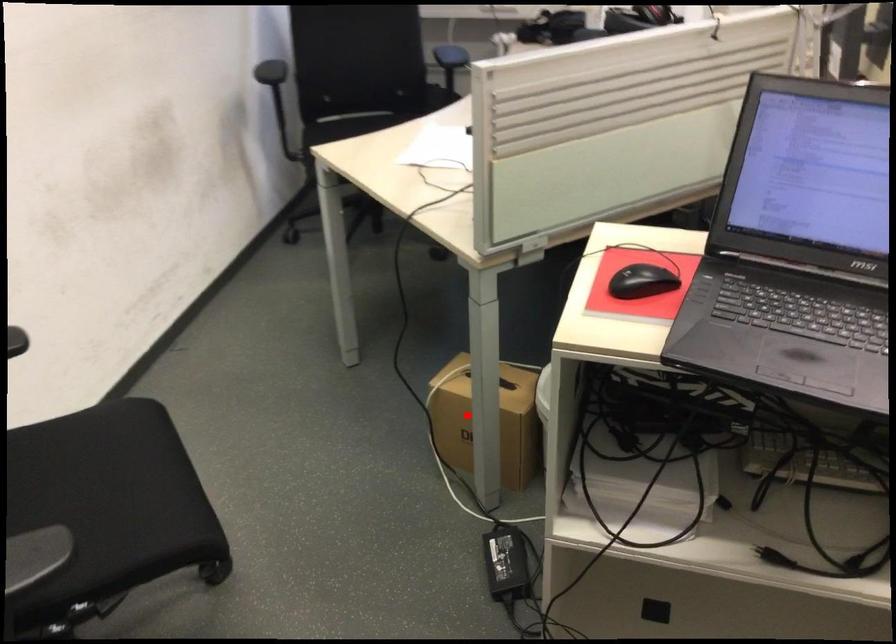
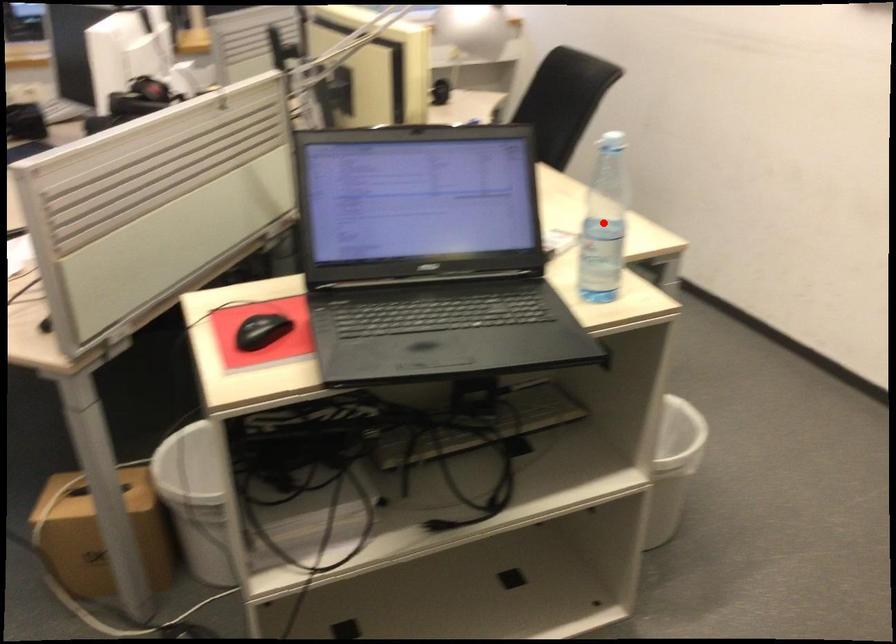
I am providing you with two images of the same scene from different viewpoints. A red point is marked on the first image and another point is marked on the second image. Does the point marked in image1 correspond to the same location as the one in image2?

No